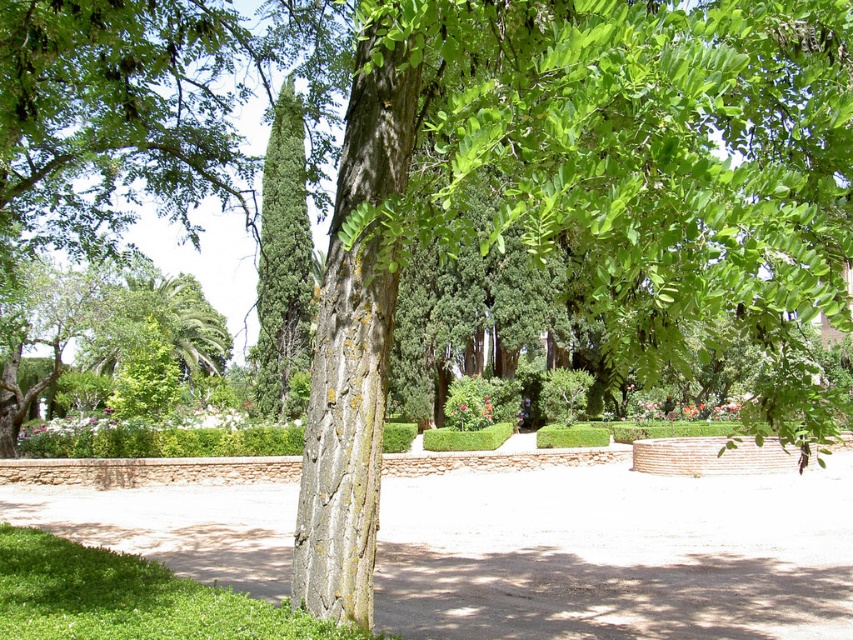
You are a gardener standing in the garden and want to water both the smooth bark tree trunk at center and the green textured cypress at center. Which one do you need to move closer to in order to water it properly?

The smooth bark tree trunk at center is in front of the green textured cypress at center, so you need to move closer to the green textured cypress at center to water it properly because it is farther away.

You are standing in the garden and see both the smooth bark tree trunk at center and the green textured cypress at center. Which tree is positioned to the left?

The green textured cypress at center is positioned to the left of the smooth bark tree trunk at center.

You are a landscape architect designing a walking path between the smooth bark tree trunk at center and the green textured cypress at center. The path needs to be 10 meters long. Can you fit the path between them?

The distance between the smooth bark tree trunk at center and the green textured cypress at center is 13.32 meters, so a 10 meter path can easily fit between them.